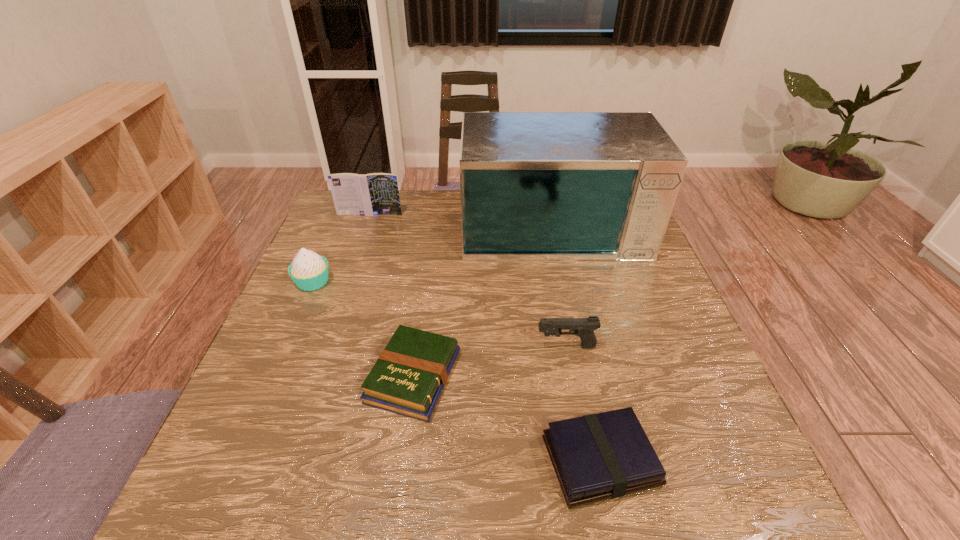
Locate an element on the screen. This screenshot has width=960, height=540. vacant region located at the barrel of the fourth tallest object is located at coordinates (424, 346).

Find the location of `vacant region located at the barrel of the fourth tallest object`. vacant region located at the barrel of the fourth tallest object is located at coordinates (492, 346).

This screenshot has height=540, width=960. What are the coordinates of `free location located 0.190m at the barrel of the fourth tallest object` in the screenshot? It's located at (451, 346).

Find the location of `free region located on the right of the second book from right to left`. free region located on the right of the second book from right to left is located at coordinates (575, 376).

The height and width of the screenshot is (540, 960). Find the location of `vacant space located on the left of the rightmost book`. vacant space located on the left of the rightmost book is located at coordinates (489, 461).

At what (x,y) coordinates should I click in order to perform the action: click on microwave oven that is at the far edge. Please return your answer as a coordinate pair (x, y). Looking at the image, I should click on (535, 186).

What are the coordinates of `book located in the far edge section of the desktop` in the screenshot? It's located at (372, 194).

The image size is (960, 540). What are the coordinates of `object that is positioned at the near edge` in the screenshot? It's located at (596, 457).

This screenshot has height=540, width=960. I want to click on book that is positioned at the left edge, so click(x=372, y=194).

The width and height of the screenshot is (960, 540). I want to click on cupcake present at the left edge, so click(309, 271).